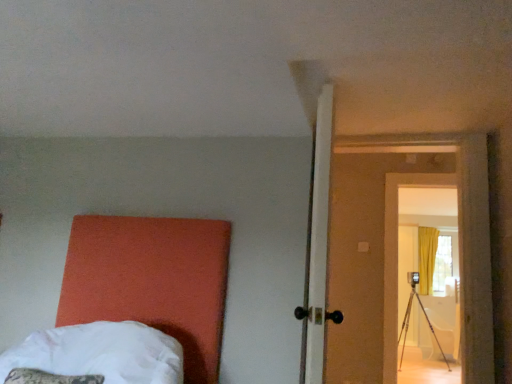
Measure the distance between point (54, 333) and camera.

The depth of point (54, 333) is 1.92 meters.

Where is `white soft bed at lower left`? Image resolution: width=512 pixels, height=384 pixels. white soft bed at lower left is located at coordinates (101, 353).

This screenshot has width=512, height=384. What do you see at coordinates (101, 353) in the screenshot?
I see `white soft bed at lower left` at bounding box center [101, 353].

Describe the element at coordinates (318, 242) in the screenshot. This screenshot has width=512, height=384. I see `wooden door at center-right` at that location.

At what (x,y) coordinates should I click in order to perform the action: click on wooden door at center-right. Please return your answer as a coordinate pair (x, y). Image resolution: width=512 pixels, height=384 pixels. Looking at the image, I should click on (318, 242).

Where is `white soft bed at lower left`? Image resolution: width=512 pixels, height=384 pixels. white soft bed at lower left is located at coordinates (101, 353).

Does white soft bed at lower left appear on the right side of wooden door at center-right?

Incorrect, white soft bed at lower left is not on the right side of wooden door at center-right.

Which is behind, white soft bed at lower left or wooden door at center-right?

Positioned behind is wooden door at center-right.

Is point (74, 342) positioned after point (324, 120)?

Yes, it is.

From the picture: From the image's perspective, does white soft bed at lower left appear lower than wooden door at center-right?

Yes, from the image's perspective, white soft bed at lower left is below wooden door at center-right.

From a real-world perspective, which is physically below, white soft bed at lower left or wooden door at center-right?

From a 3D spatial view, white soft bed at lower left is below.

Considering the relative sizes of white soft bed at lower left and wooden door at center-right in the image provided, is white soft bed at lower left thinner than wooden door at center-right?

No, white soft bed at lower left is not thinner than wooden door at center-right.

Who is taller, white soft bed at lower left or wooden door at center-right?

wooden door at center-right is taller.

Can you confirm if white soft bed at lower left is bigger than wooden door at center-right?

No.

Is wooden door at center-right completely or partially inside white soft bed at lower left?

No, wooden door at center-right is located outside of white soft bed at lower left.

Is white soft bed at lower left far away from wooden door at center-right?

No.

Does white soft bed at lower left turn towards wooden door at center-right?

No, white soft bed at lower left is not facing towards wooden door at center-right.

Can you tell me how much white soft bed at lower left and wooden door at center-right differ in facing direction?

84.1 degrees.

I want to click on door that is above the white soft bed at lower left (from a real-world perspective), so (318, 242).

Can you confirm if wooden door at center-right is positioned to the right of white soft bed at lower left?

Yes, wooden door at center-right is to the right of white soft bed at lower left.

Which object is further away from the camera, wooden door at center-right or white soft bed at lower left?

wooden door at center-right is behind.

Is point (323, 181) farther from viewer compared to point (127, 324)?

No, it is not.

From the image's perspective, is wooden door at center-right located above white soft bed at lower left?

Indeed, from the image's perspective, wooden door at center-right is shown above white soft bed at lower left.

From a real-world perspective, does wooden door at center-right sit lower than white soft bed at lower left?

No, from a real-world perspective, wooden door at center-right is not beneath white soft bed at lower left.

Does wooden door at center-right have a lesser width compared to white soft bed at lower left?

Correct, the width of wooden door at center-right is less than that of white soft bed at lower left.

Which of these two, wooden door at center-right or white soft bed at lower left, stands shorter?

Standing shorter between the two is white soft bed at lower left.

Is wooden door at center-right smaller than white soft bed at lower left?

Actually, wooden door at center-right might be larger than white soft bed at lower left.

Is white soft bed at lower left located within wooden door at center-right?

No, white soft bed at lower left is located outside of wooden door at center-right.

Is wooden door at center-right in contact with white soft bed at lower left?

They are not placed beside each other.

Could you tell me if wooden door at center-right is turned towards white soft bed at lower left?

Yes, wooden door at center-right faces towards white soft bed at lower left.

Identify the location of door behind the white soft bed at lower left. The width and height of the screenshot is (512, 384). (318, 242).

Identify the location of bed located underneath the wooden door at center-right (from a real-world perspective). (101, 353).

The width and height of the screenshot is (512, 384). Identify the location of door behind the white soft bed at lower left. (318, 242).